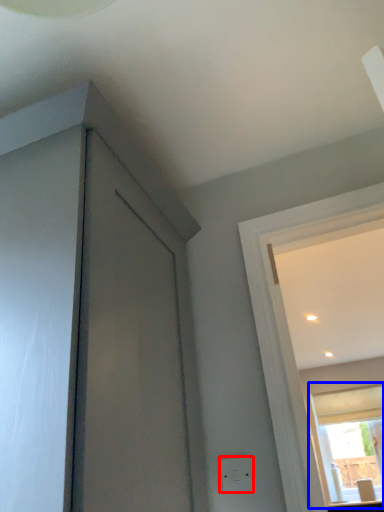
Question: Which point is closer to the camera, electric outlet (highlighted by a red box) or window (highlighted by a blue box)?

Choices:
 (A) electric outlet
 (B) window

Answer: (A)